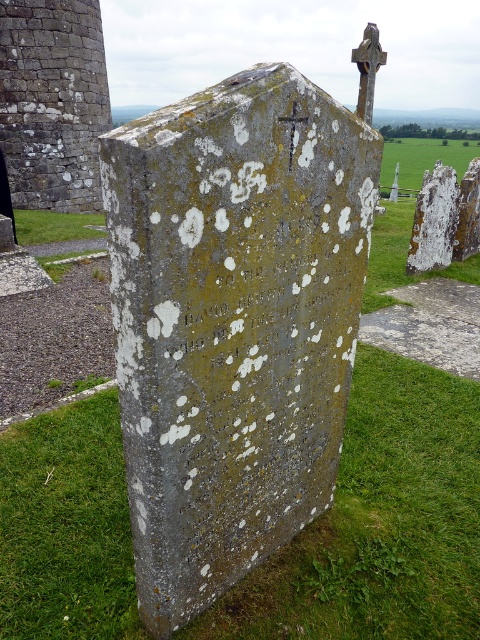
Question: Is speckled stone gravestone at center thinner than green grass at upper center?

Choices:
 (A) yes
 (B) no

Answer: (A)

Question: Is speckled stone gravestone at center positioned at the back of green grass at upper center?

Choices:
 (A) no
 (B) yes

Answer: (A)

Question: Which object is farther from the camera taking this photo?

Choices:
 (A) speckled stone gravestone at center
 (B) green grass at upper center

Answer: (B)

Question: Which point appears closest to the camera in this image?

Choices:
 (A) (408, 148)
 (B) (169, 388)

Answer: (B)

Question: Is speckled stone gravestone at center further to camera compared to green grass at upper center?

Choices:
 (A) no
 (B) yes

Answer: (A)

Question: Which point is farther to the camera?

Choices:
 (A) (412, 154)
 (B) (297, 253)

Answer: (A)